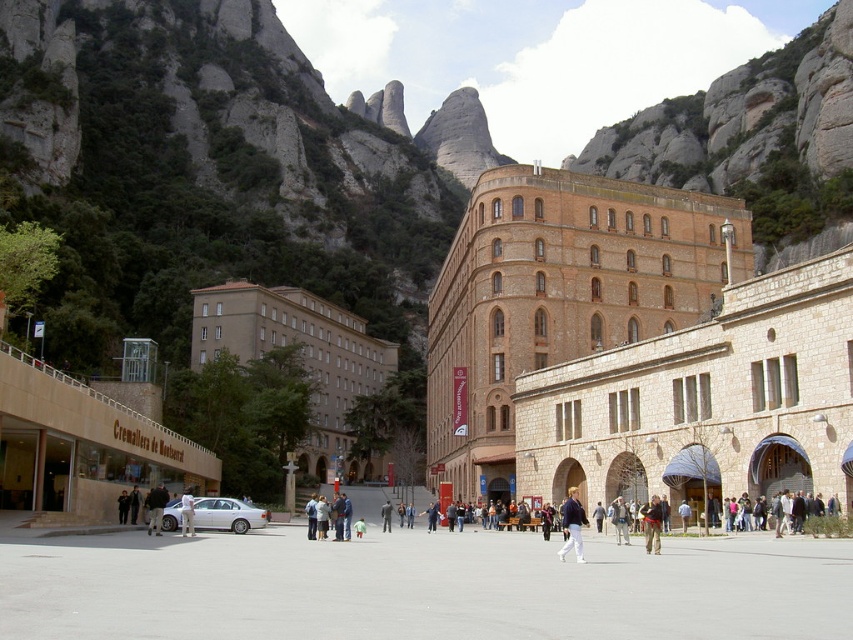
Who is more forward, (161,520) or (660,518)?

Positioned in front is point (161,520).

Is point (219, 529) positioned after point (643, 518)?

Yes, it is.

Measure the distance between white matte sedan at center and camera.

A distance of 42.49 meters exists between white matte sedan at center and camera.

Identify the location of white matte sedan at center. The image size is (853, 640). (227, 515).

Who is shorter, dark gray jacket at center or white cotton shirt at center?

dark gray jacket at center is shorter.

Is dark gray jacket at center below white cotton shirt at center?

Actually, dark gray jacket at center is above white cotton shirt at center.

Find the location of a particular element. This screenshot has width=853, height=640. dark gray jacket at center is located at coordinates (155, 508).

Does dark gray jacket at center have a lesser width compared to light brown leather jacket at center?

No.

Which is more to the right, dark gray jacket at center or light brown leather jacket at center?

light brown leather jacket at center is more to the right.

Who is more forward, (160, 513) or (618, 520)?

Point (618, 520) is in front.

The width and height of the screenshot is (853, 640). I want to click on dark gray jacket at center, so click(x=155, y=508).